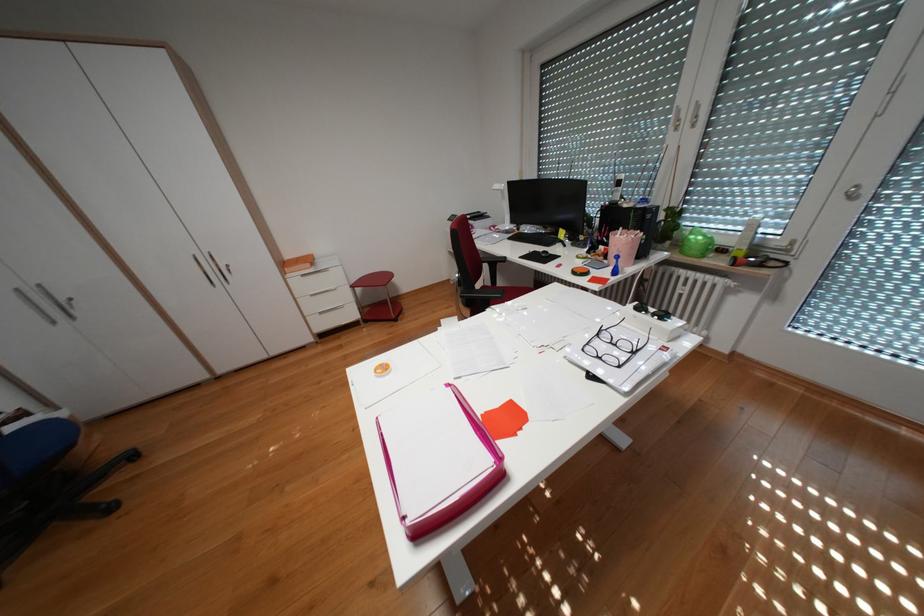
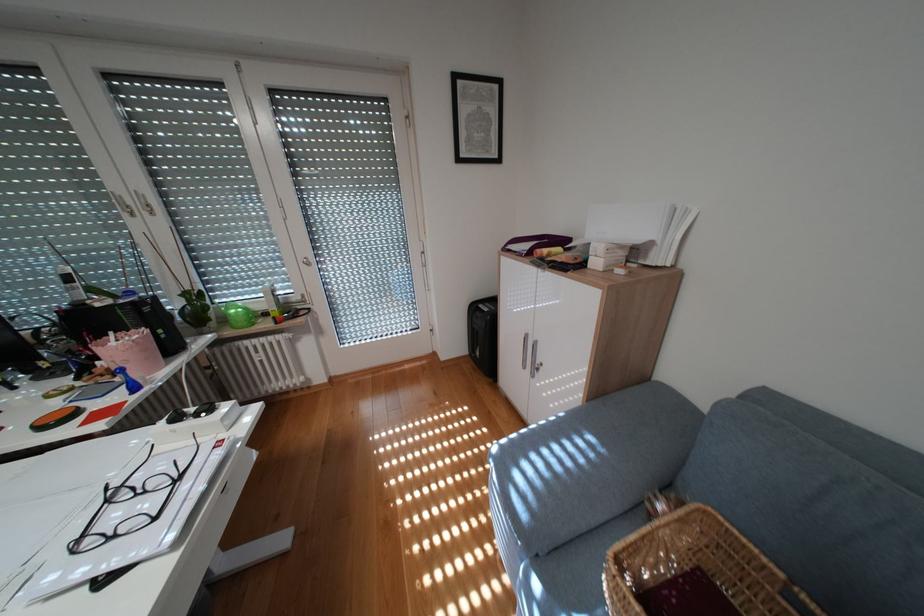
The point at (652, 308) is marked in the first image. Where is the corresponding point in the second image?

(188, 418)